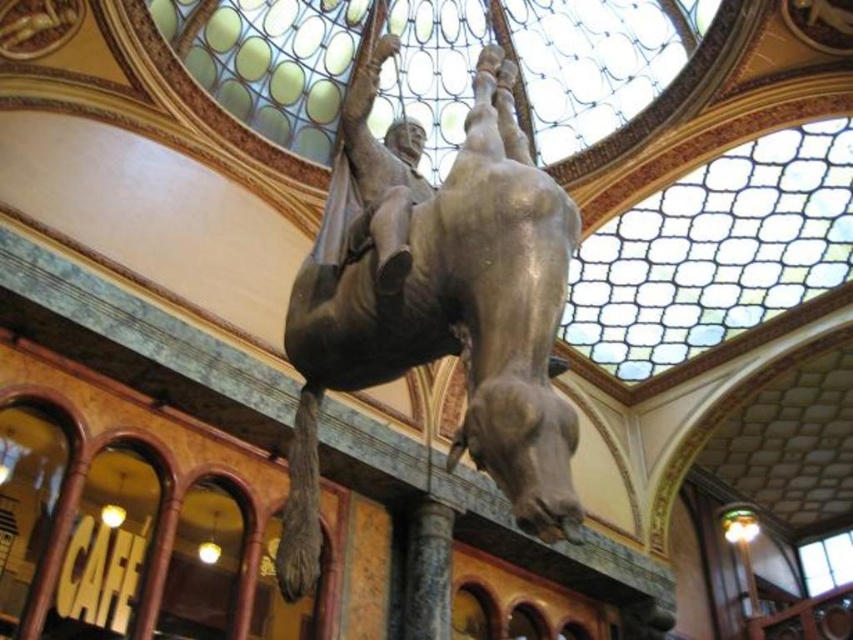
You are an interior designer planning to install a new lighting fixture above the bronze statue at center and the granite column at center. Given their heights, which object requires a higher suspension point to ensure the light does not hit either object?

The bronze statue at center requires a higher suspension point because it is taller than the granite column at center, so the light must be hung higher above it to avoid contact.

You are standing in the grand hall and want to locate the exact point at coordinates point (450, 324). Where would this point be located on the sculpture?

The point (450, 324) is on bronze statue at center.

You are an art curator standing in the grand hall and want to view the bronze statue at center. Considering the distance, can you clearly see the details of the sculpture from where you are standing?

The bronze statue at center is 23.83 meters away from the viewer. At this distance, it may be challenging to discern fine details without assistance, such as binoculars or moving closer.